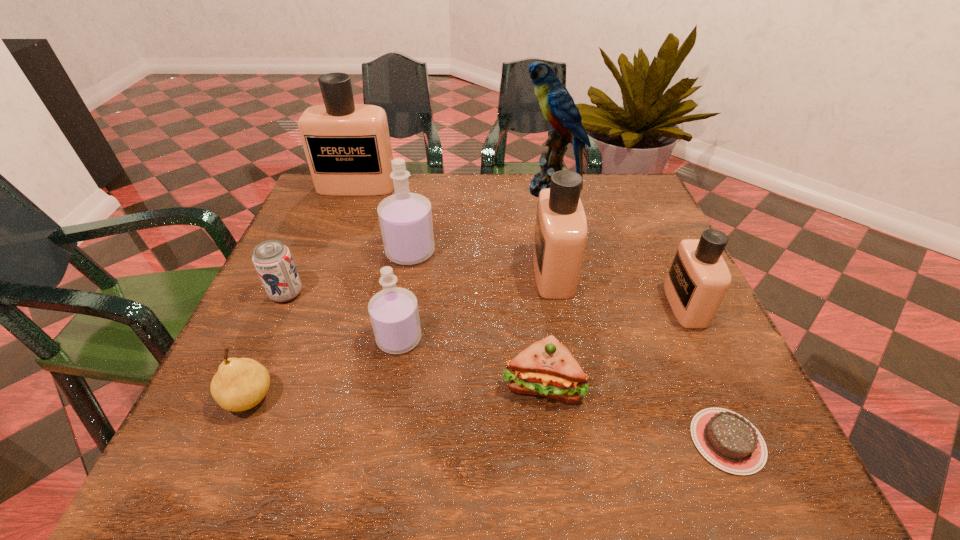
Where is `object at the near left corner`? object at the near left corner is located at coordinates (240, 384).

Find the location of `object that is at the near right corner`. object that is at the near right corner is located at coordinates (726, 439).

This screenshot has height=540, width=960. In order to click on vacant space at the far edge of the desktop in this screenshot , I will do `click(498, 199)`.

Identify the location of vacant space at the near edge of the desktop. Image resolution: width=960 pixels, height=540 pixels. (661, 455).

Locate an element on the screen. free spot at the left edge of the desktop is located at coordinates (338, 271).

Identify the location of free region at the right edge of the desktop. (679, 399).

Where is `blank space at the far left corner of the desktop`? This screenshot has width=960, height=540. blank space at the far left corner of the desktop is located at coordinates (356, 214).

This screenshot has height=540, width=960. I want to click on free space at the far right corner of the desktop, so click(x=641, y=206).

Find the location of a particular element. The image size is (960, 540). free space at the near right corner of the desktop is located at coordinates (675, 448).

Locate an element on the screen. The image size is (960, 540). free space between the bigger purple perfume and the pear is located at coordinates (330, 325).